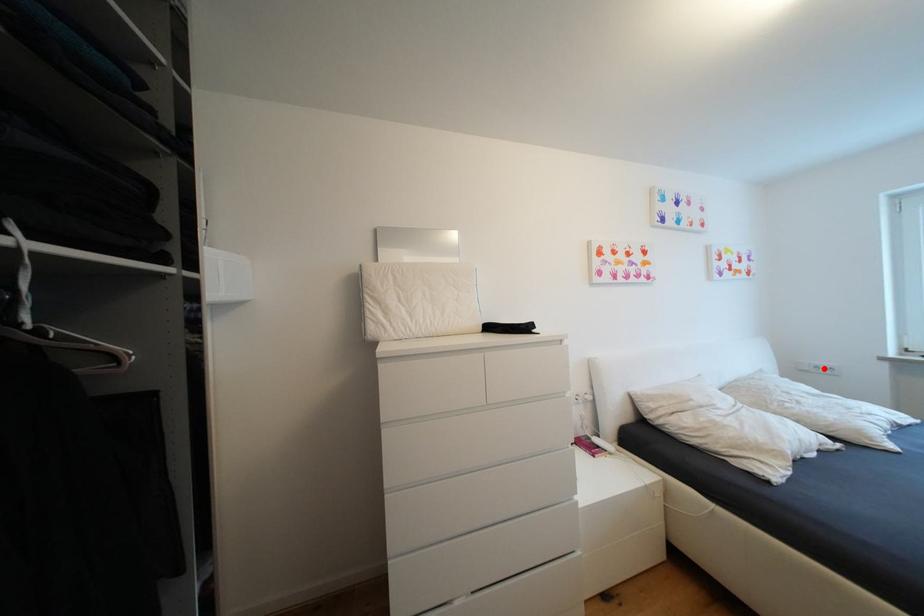
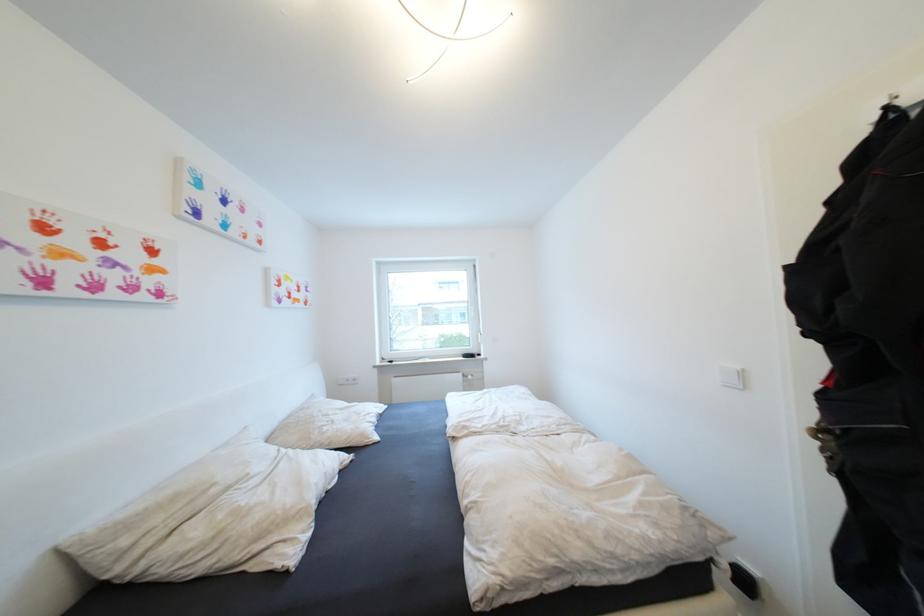
Where in the second image is the point corresponding to the highlighted location from the first image?

(355, 381)